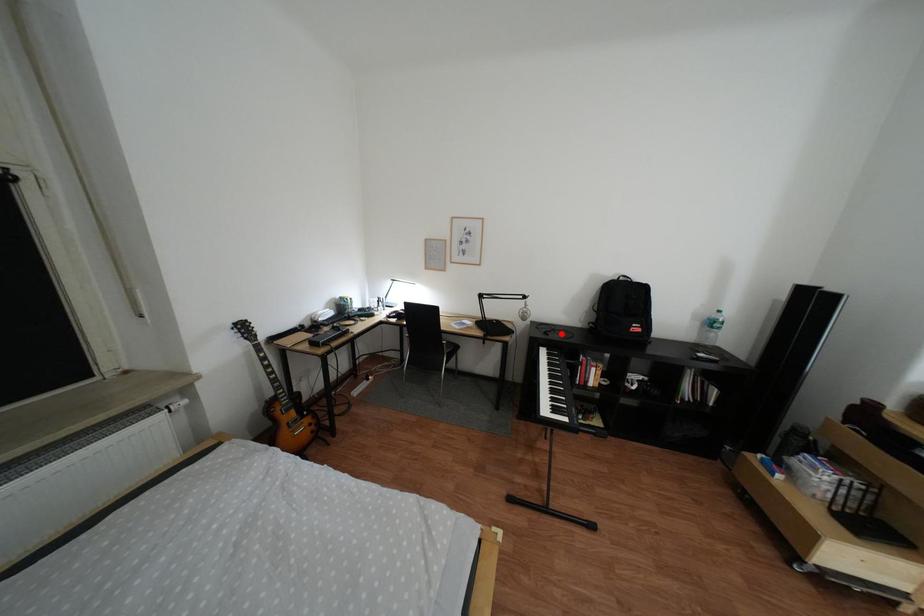
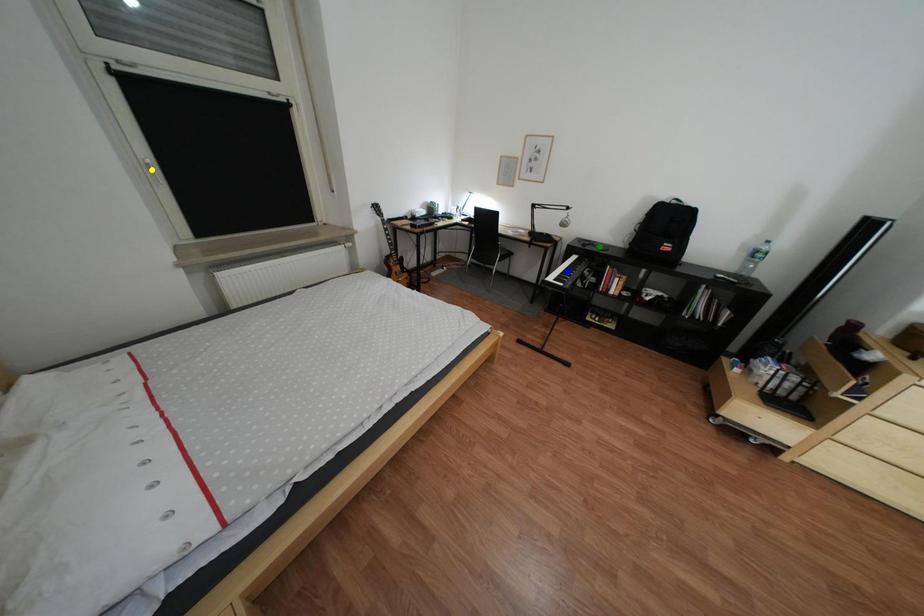
Question: I am providing you with two images of the same scene from different viewpoints. A red point is marked on the first image. You are given multiple points on the second image. Which point in image 2 is actually the same real-world point as the red point in image 1?

Choices:
 (A) yellow point
 (B) blue point
 (C) green point

Answer: (C)